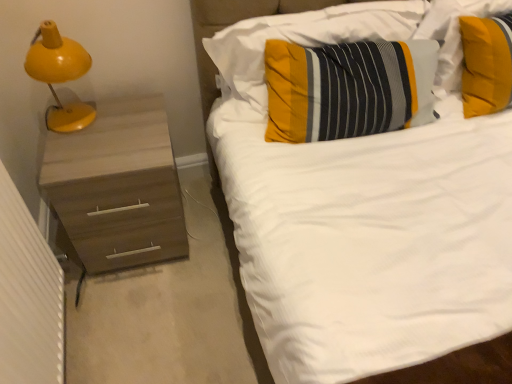
The image size is (512, 384). What do you see at coordinates (453, 35) in the screenshot?
I see `striped fabric pillow at upper right, arranged as the first pillow when viewed from the right` at bounding box center [453, 35].

The height and width of the screenshot is (384, 512). I want to click on matte wood chest of drawers at left, so click(118, 186).

Is striped fabric pillow at upper right, arranged as the first pillow when viewed from the right, wider or thinner than yellow matte lamp at left?

Considering their sizes, striped fabric pillow at upper right, arranged as the first pillow when viewed from the right, looks broader than yellow matte lamp at left.

Could you tell me if striped fabric pillow at upper right, arranged as the first pillow when viewed from the right, is turned towards yellow matte lamp at left?

No, striped fabric pillow at upper right, arranged as the first pillow when viewed from the right, does not turn towards yellow matte lamp at left.

Would you say striped fabric pillow at upper right, which ranks as the 3th pillow in left-to-right order, is outside yellow matte lamp at left?

Yes.

Find the location of a particular element. The width and height of the screenshot is (512, 384). lamp located on the left of striped fabric pillow at upper right, which ranks as the 3th pillow in left-to-right order is located at coordinates (60, 75).

Is textured yellow pillow at center, which is the second pillow in left-to-right order, facing away from striped fabric pillow at center, the first pillow in the left-to-right sequence?

Yes, textured yellow pillow at center, which is the second pillow in left-to-right order, is facing away from striped fabric pillow at center, the first pillow in the left-to-right sequence.

Considering the relative positions of textured yellow pillow at center, which is the second pillow in left-to-right order, and striped fabric pillow at center, the third pillow viewed from the right, in the image provided, is textured yellow pillow at center, which is the second pillow in left-to-right order, to the right of striped fabric pillow at center, the third pillow viewed from the right, from the viewer's perspective?

Yes.

Measure the distance from textured yellow pillow at center, which is the second pillow in left-to-right order, to striped fabric pillow at center, the third pillow viewed from the right.

textured yellow pillow at center, which is the second pillow in left-to-right order, is 5.35 inches from striped fabric pillow at center, the third pillow viewed from the right.

From the image's perspective, is textured yellow pillow at center, the 2th pillow when ordered from right to left, beneath striped fabric pillow at center, the first pillow in the left-to-right sequence?

Yes, from the image's perspective, textured yellow pillow at center, the 2th pillow when ordered from right to left, is beneath striped fabric pillow at center, the first pillow in the left-to-right sequence.

Can you confirm if matte wood chest of drawers at left is wider than striped fabric pillow at upper right, which ranks as the 3th pillow in left-to-right order?

Indeed, matte wood chest of drawers at left has a greater width compared to striped fabric pillow at upper right, which ranks as the 3th pillow in left-to-right order.

From a real-world perspective, is matte wood chest of drawers at left physically located above or below striped fabric pillow at upper right, arranged as the first pillow when viewed from the right?

Result: matte wood chest of drawers at left is situated lower than striped fabric pillow at upper right, arranged as the first pillow when viewed from the right, in the real world.

In the scene shown: From their relative heights in the image, would you say matte wood chest of drawers at left is taller or shorter than striped fabric pillow at upper right, which ranks as the 3th pillow in left-to-right order?

Clearly, matte wood chest of drawers at left is taller compared to striped fabric pillow at upper right, which ranks as the 3th pillow in left-to-right order.

Is point (71, 141) less distant than point (458, 23)?

Yes, point (71, 141) is closer to viewer.

Does yellow matte lamp at left have a larger size compared to textured yellow pillow at center, the 2th pillow when ordered from right to left?

Incorrect, yellow matte lamp at left is not larger than textured yellow pillow at center, the 2th pillow when ordered from right to left.

Does yellow matte lamp at left contain textured yellow pillow at center, which is the second pillow in left-to-right order?

No, yellow matte lamp at left does not contain textured yellow pillow at center, which is the second pillow in left-to-right order.

Can you confirm if yellow matte lamp at left is shorter than textured yellow pillow at center, which is the second pillow in left-to-right order?

Incorrect, the height of yellow matte lamp at left does not fall short of that of textured yellow pillow at center, which is the second pillow in left-to-right order.

From a real-world perspective, is yellow matte lamp at left beneath textured yellow pillow at center, the 2th pillow when ordered from right to left?

No.

Is yellow matte lamp at left taller or shorter than matte wood chest of drawers at left?

yellow matte lamp at left is shorter than matte wood chest of drawers at left.

What's the angular difference between yellow matte lamp at left and matte wood chest of drawers at left's facing directions?

The facing directions of yellow matte lamp at left and matte wood chest of drawers at left are 1 degrees apart.

From the image's perspective, which object appears higher, yellow matte lamp at left or matte wood chest of drawers at left?

From the image's view, yellow matte lamp at left is above.

Is yellow matte lamp at left not close to matte wood chest of drawers at left?

Actually, yellow matte lamp at left and matte wood chest of drawers at left are a little close together.

What's the angular difference between striped fabric pillow at center, the third pillow viewed from the right, and textured yellow pillow at center, which is the second pillow in left-to-right order,'s facing directions?

8.37 degrees separate the facing orientations of striped fabric pillow at center, the third pillow viewed from the right, and textured yellow pillow at center, which is the second pillow in left-to-right order.

Is striped fabric pillow at center, the first pillow in the left-to-right sequence, shorter than textured yellow pillow at center, the 2th pillow when ordered from right to left?

No.

From the image's perspective, is striped fabric pillow at center, the first pillow in the left-to-right sequence, located above or below textured yellow pillow at center, which is the second pillow in left-to-right order?

Based on their image positions, striped fabric pillow at center, the first pillow in the left-to-right sequence, is located above textured yellow pillow at center, which is the second pillow in left-to-right order.

Does matte wood chest of drawers at left appear on the left side of striped fabric pillow at center, the third pillow viewed from the right?

Yes, matte wood chest of drawers at left is to the left of striped fabric pillow at center, the third pillow viewed from the right.

Can you confirm if matte wood chest of drawers at left is taller than striped fabric pillow at center, the first pillow in the left-to-right sequence?

Indeed, matte wood chest of drawers at left has a greater height compared to striped fabric pillow at center, the first pillow in the left-to-right sequence.

Is matte wood chest of drawers at left positioned far away from striped fabric pillow at center, the third pillow viewed from the right?

No.

Is matte wood chest of drawers at left surrounding striped fabric pillow at center, the third pillow viewed from the right?

No, striped fabric pillow at center, the third pillow viewed from the right, is not surrounded by matte wood chest of drawers at left.

Where is `pillow that is the 3rd object located behind the yellow matte lamp at left`? pillow that is the 3rd object located behind the yellow matte lamp at left is located at coordinates (453, 35).

Find the location of a particular element. This screenshot has width=512, height=384. pillow on the left of textured yellow pillow at center, the 2th pillow when ordered from right to left is located at coordinates (298, 44).

From the image, which object appears to be farther from yellow matte lamp at left, textured yellow pillow at center, the 2th pillow when ordered from right to left, or striped fabric pillow at center, the first pillow in the left-to-right sequence?

The object further to yellow matte lamp at left is textured yellow pillow at center, the 2th pillow when ordered from right to left.

Estimate the real-world distances between objects in this image. Which object is further from striped fabric pillow at center, the first pillow in the left-to-right sequence, striped fabric pillow at upper right, arranged as the first pillow when viewed from the right, or matte wood chest of drawers at left?

The object further to striped fabric pillow at center, the first pillow in the left-to-right sequence, is matte wood chest of drawers at left.

Which object lies nearer to the anchor point matte wood chest of drawers at left, textured yellow pillow at center, the 2th pillow when ordered from right to left, or striped fabric pillow at center, the third pillow viewed from the right?

striped fabric pillow at center, the third pillow viewed from the right, lies closer to matte wood chest of drawers at left than the other object.

Based on their spatial positions, is striped fabric pillow at center, the first pillow in the left-to-right sequence, or textured yellow pillow at center, which is the second pillow in left-to-right order, further from matte wood chest of drawers at left?

textured yellow pillow at center, which is the second pillow in left-to-right order, is positioned further to the anchor matte wood chest of drawers at left.

When comparing their distances from striped fabric pillow at upper right, which ranks as the 3th pillow in left-to-right order, does yellow matte lamp at left or textured yellow pillow at center, the 2th pillow when ordered from right to left, seem closer?

textured yellow pillow at center, the 2th pillow when ordered from right to left, is closer to striped fabric pillow at upper right, which ranks as the 3th pillow in left-to-right order.

Looking at the image, which one is located further to yellow matte lamp at left, striped fabric pillow at center, the third pillow viewed from the right, or striped fabric pillow at upper right, arranged as the first pillow when viewed from the right?

The object further to yellow matte lamp at left is striped fabric pillow at upper right, arranged as the first pillow when viewed from the right.

From the image, which object appears to be farther from textured yellow pillow at center, which is the second pillow in left-to-right order, striped fabric pillow at upper right, which ranks as the 3th pillow in left-to-right order, or striped fabric pillow at center, the first pillow in the left-to-right sequence?

striped fabric pillow at upper right, which ranks as the 3th pillow in left-to-right order, is positioned further to the anchor textured yellow pillow at center, which is the second pillow in left-to-right order.

Based on their spatial positions, is striped fabric pillow at upper right, arranged as the first pillow when viewed from the right, or textured yellow pillow at center, the 2th pillow when ordered from right to left, further from striped fabric pillow at center, the first pillow in the left-to-right sequence?

striped fabric pillow at upper right, arranged as the first pillow when viewed from the right, lies further to striped fabric pillow at center, the first pillow in the left-to-right sequence, than the other object.

Find the location of a particular element. The width and height of the screenshot is (512, 384). pillow between yellow matte lamp at left and textured yellow pillow at center, which is the second pillow in left-to-right order is located at coordinates (298, 44).

Where is `the chest of drawers located between yellow matte lamp at left and striped fabric pillow at upper right, arranged as the first pillow when viewed from the right, in the left-right direction`? The image size is (512, 384). the chest of drawers located between yellow matte lamp at left and striped fabric pillow at upper right, arranged as the first pillow when viewed from the right, in the left-right direction is located at coordinates (118, 186).

You are a GUI agent. You are given a task and a screenshot of the screen. Output one action in this format:
    pyautogui.click(x=<x>, y=<y>)
    Task: Click on the chest of drawers situated between yellow matte lamp at left and textured yellow pillow at center, the 2th pillow when ordered from right to left, from left to right
    The height and width of the screenshot is (384, 512).
    Given the screenshot: What is the action you would take?
    pyautogui.click(x=118, y=186)

Where is `chest of drawers between yellow matte lamp at left and striped fabric pillow at center, the third pillow viewed from the right, from left to right`? This screenshot has height=384, width=512. chest of drawers between yellow matte lamp at left and striped fabric pillow at center, the third pillow viewed from the right, from left to right is located at coordinates (118, 186).